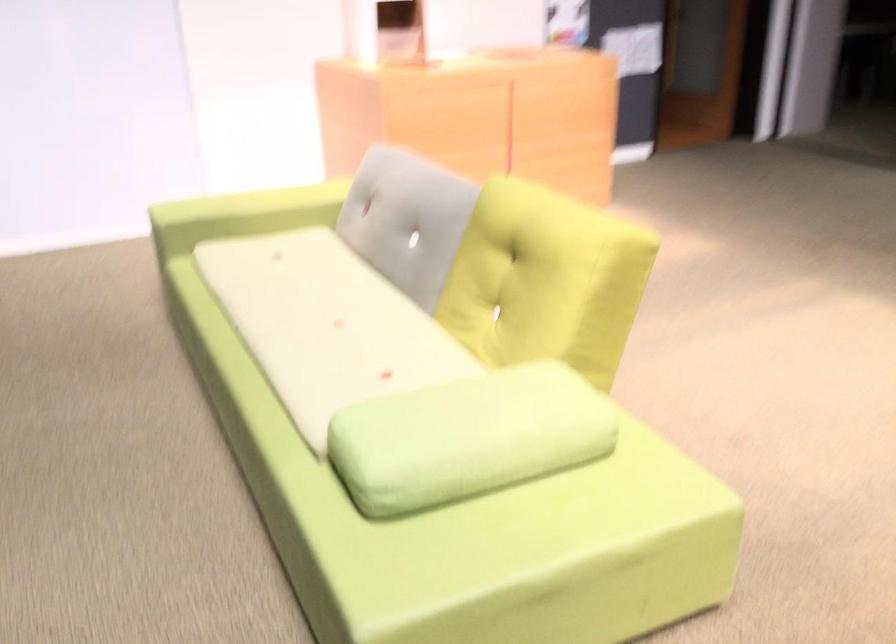
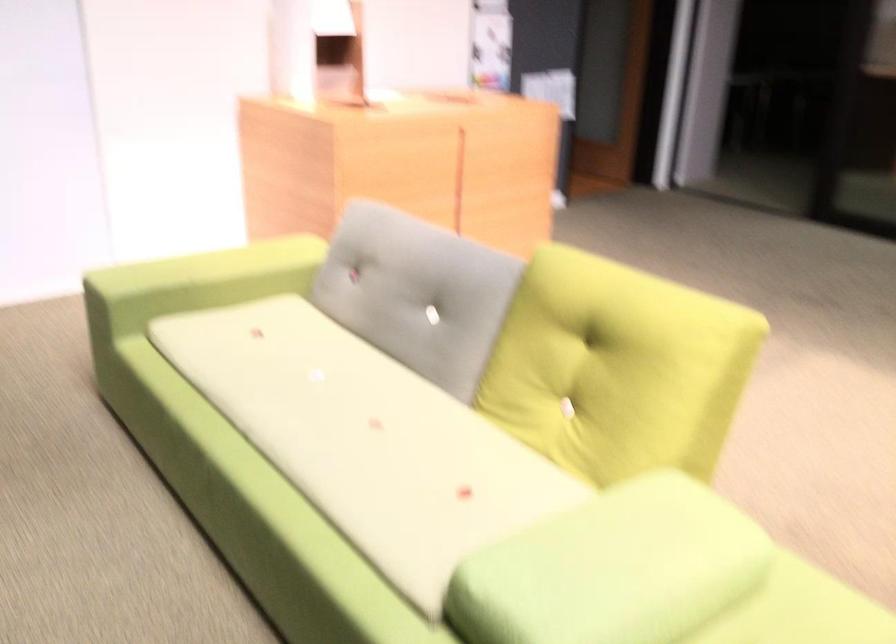
In the second image, find the point that corresponds to (x=233, y=216) in the first image.

(194, 283)